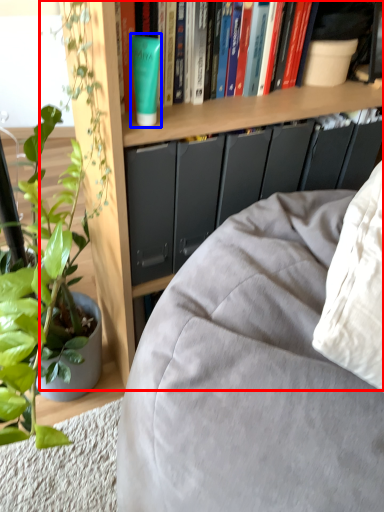
Question: Which object is closer to the camera taking this photo, bookcase (highlighted by a red box) or paperback book (highlighted by a blue box)?

Choices:
 (A) bookcase
 (B) paperback book

Answer: (A)